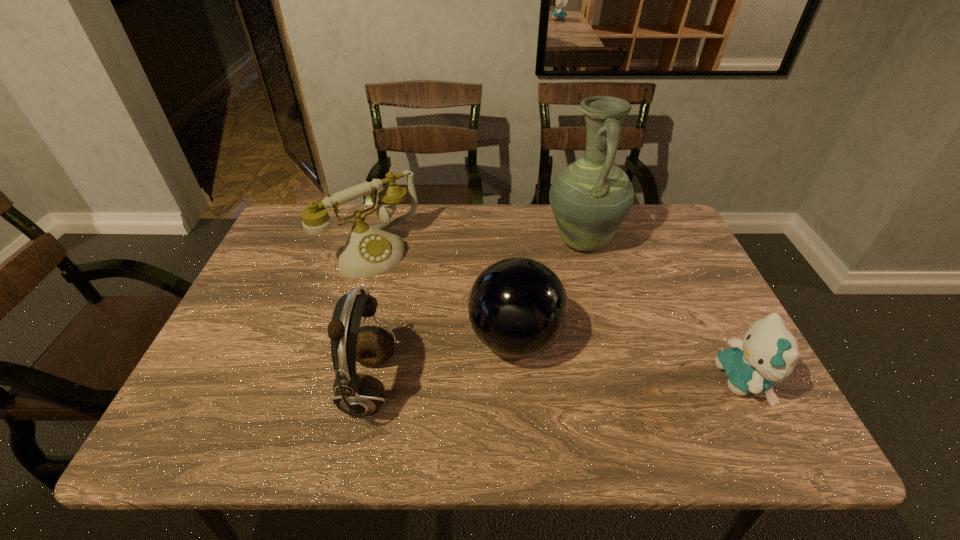
Find the location of a particular element. free space on the desktop that is between the earphone and the kitten and is positioned on the dial of the telephone is located at coordinates (509, 384).

At what (x,y) coordinates should I click in order to perform the action: click on free space on the desktop that is between the fourth shortest object and the rightmost object and is positioned on the side of the bowling ball with the finger holes. Please return your answer as a coordinate pair (x, y). Looking at the image, I should click on (611, 382).

Identify the location of free space on the desktop that is between the earphone and the shortest object and is positioned on the handle side of the tallest object. (530, 384).